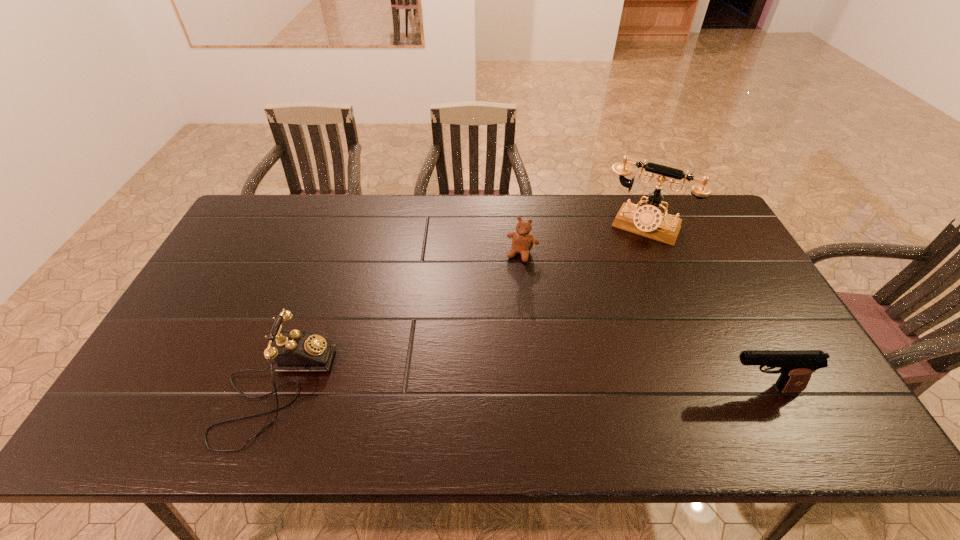
Locate an element on the screen. The height and width of the screenshot is (540, 960). telephone that is at the right edge is located at coordinates (648, 220).

The image size is (960, 540). In order to click on object present at the far right corner in this screenshot , I will do `click(648, 220)`.

The height and width of the screenshot is (540, 960). I want to click on object positioned at the near right corner, so click(796, 367).

This screenshot has height=540, width=960. I want to click on free space at the far edge of the desktop, so click(x=423, y=206).

This screenshot has width=960, height=540. In order to click on free region at the near edge of the desktop in this screenshot , I will do `click(426, 387)`.

Locate an element on the screen. Image resolution: width=960 pixels, height=540 pixels. vacant space at the near left corner of the desktop is located at coordinates pos(190,377).

Locate an element on the screen. blank region between the third object from right to left and the pistol is located at coordinates (641, 321).

Locate an element on the screen. The width and height of the screenshot is (960, 540). free area in between the tallest object and the pistol is located at coordinates (703, 308).

Image resolution: width=960 pixels, height=540 pixels. What are the coordinates of `vacant area between the shorter telephone and the pistol` in the screenshot? It's located at (518, 389).

Identify the location of vacant area between the second object from left to right and the farther telephone. This screenshot has width=960, height=540. (584, 240).